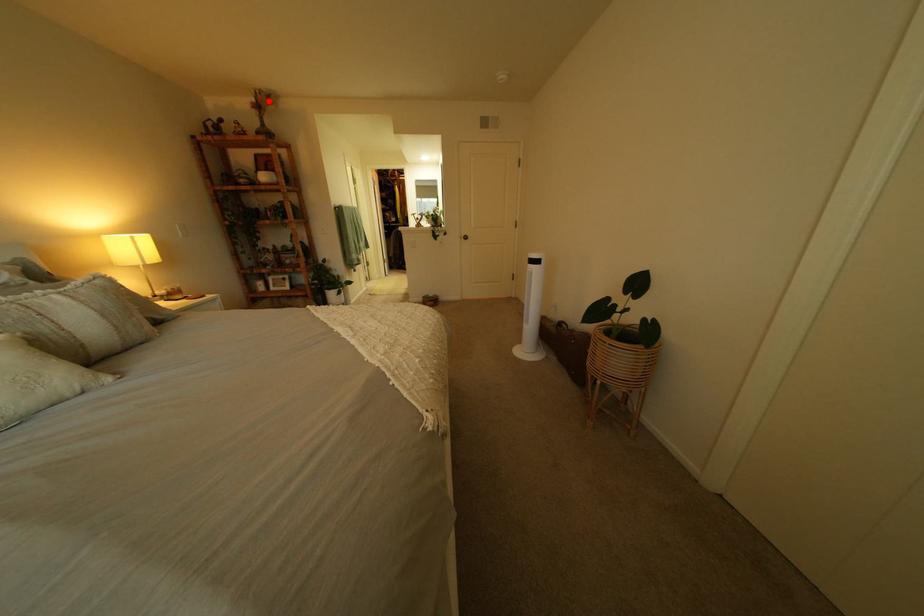
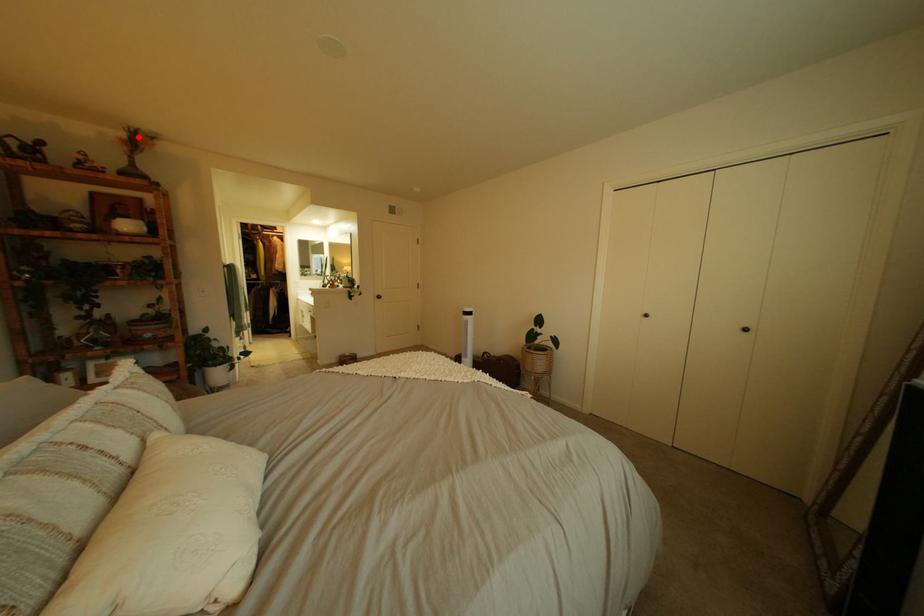
I am providing you with two images of the same scene from different viewpoints. A red point is marked on the first image and another point is marked on the second image. Does the point marked in image1 correspond to the same location as the one in image2?

Yes